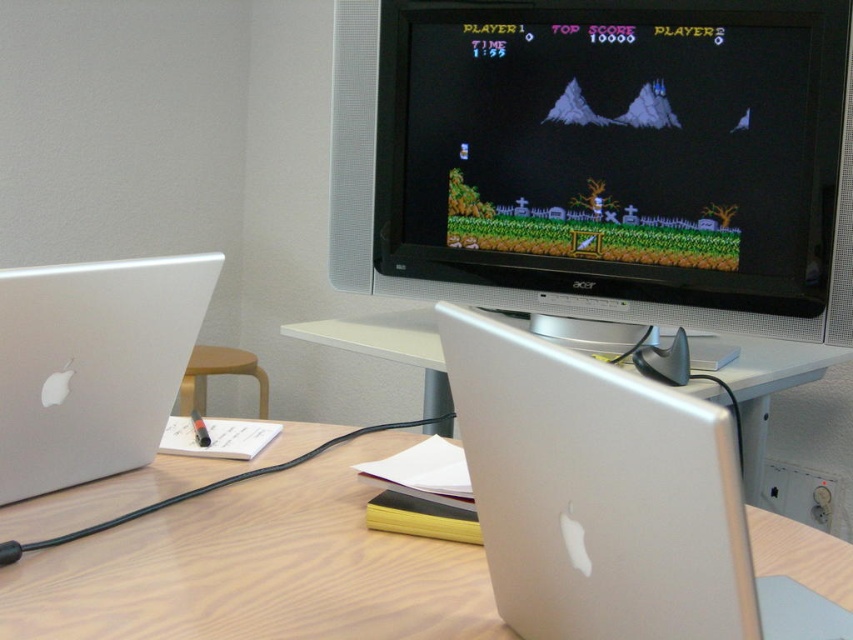
Is silver metallic computer desk at lower center in front of silver metallic laptop at left?

Yes, silver metallic computer desk at lower center is in front of silver metallic laptop at left.

Who is more distant from viewer, [140,579] or [117,332]?

The point [117,332] is behind.

Find the location of a particular element. This screenshot has height=640, width=853. silver metallic computer desk at lower center is located at coordinates (256, 570).

Can you confirm if silver metallic computer desk at lower center is shorter than silver metallic computer desk at center?

Correct, silver metallic computer desk at lower center is not as tall as silver metallic computer desk at center.

Does point (405, 596) come farther from viewer compared to point (398, 355)?

No, (405, 596) is closer to viewer.

What do you see at coordinates (256, 570) in the screenshot? I see `silver metallic computer desk at lower center` at bounding box center [256, 570].

The height and width of the screenshot is (640, 853). What are the coordinates of `silver metallic computer desk at lower center` in the screenshot? It's located at (256, 570).

Which is behind, point (456, 593) or point (456, 291)?

The point (456, 291) is behind.

Is silver metallic computer desk at lower center taller than black plastic monitor at upper center?

In fact, silver metallic computer desk at lower center may be shorter than black plastic monitor at upper center.

What do you see at coordinates (256, 570) in the screenshot? This screenshot has height=640, width=853. I see `silver metallic computer desk at lower center` at bounding box center [256, 570].

Locate an element on the screen. The height and width of the screenshot is (640, 853). silver metallic computer desk at lower center is located at coordinates coord(256,570).